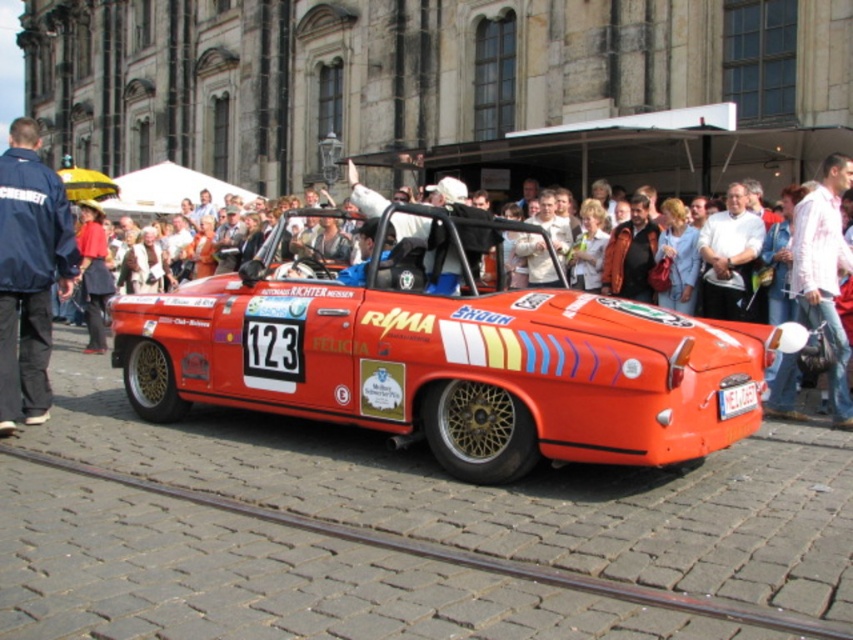
Looking at this image, you are a photographer at the event and want to capture a photo of the yellow plastic license plate at center without the white shirt at center blocking it. What should you do?

The white shirt at center is above the yellow plastic license plate at center, so you should angle your camera downward to avoid the white shirt at center blocking the license plate.

You are standing at the event and want to take a photo of both the bright orange vintage race car and the historic stone building. You notice two points marked in the image. If you position yourself closer to point (822, 208), will you be able to capture both the car and the building in your shot compared to positioning yourself at point (752, 396)?

Since point (822, 208) is closer to you than point (752, 396), positioning yourself there would place you nearer to the car and farther from the building. This might make it harder to include both in the frame compared to point (752, 396), which is further away from you, allowing a wider angle to capture both the car and the building.

You are a photographer at the event and want to capture both the blue jacket at left and the yellow plastic license plate at center in a single frame. Based on their positions, which object is higher in the image?

The blue jacket at left is above the yellow plastic license plate at center, so it is higher in the image.